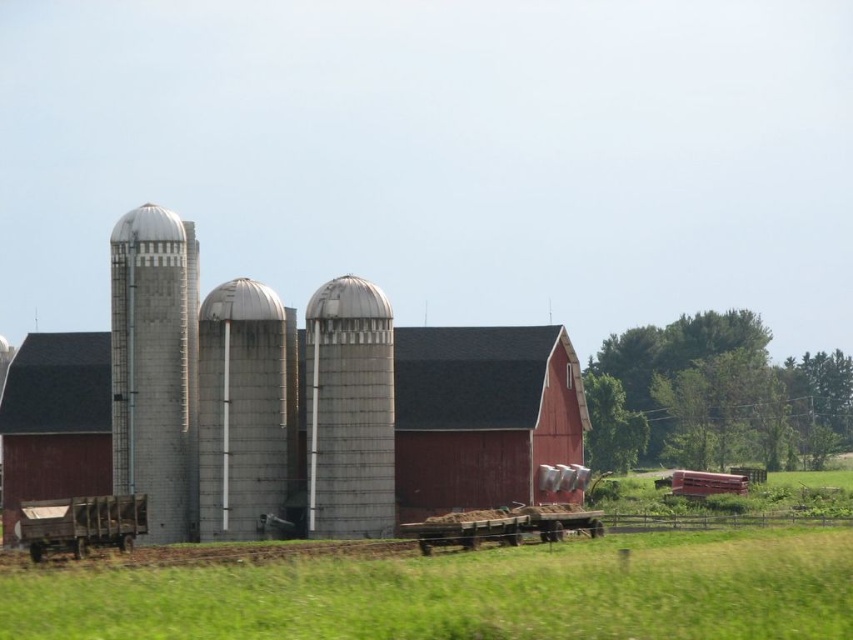
Is brown wooden wagon at lower center to the left of smooth wooden wagon at lower right from the viewer's perspective?

Indeed, brown wooden wagon at lower center is positioned on the left side of smooth wooden wagon at lower right.

Can you confirm if brown wooden wagon at lower center is smaller than smooth wooden wagon at lower right?

Incorrect, brown wooden wagon at lower center is not smaller in size than smooth wooden wagon at lower right.

What are the coordinates of `brown wooden wagon at lower center` in the screenshot? It's located at (502, 525).

Can you confirm if red painted wood barn at center is positioned to the left of sanded concrete silo at center?

Yes, red painted wood barn at center is to the left of sanded concrete silo at center.

Which is more to the left, red painted wood barn at center or sanded concrete silo at center?

Positioned to the left is red painted wood barn at center.

Where is `red painted wood barn at center`? Image resolution: width=853 pixels, height=640 pixels. red painted wood barn at center is located at coordinates (482, 416).

How much distance is there between red painted wood barn at center and brown wooden wagon at lower center?

8.36 meters

Describe the element at coordinates (482, 416) in the screenshot. I see `red painted wood barn at center` at that location.

The height and width of the screenshot is (640, 853). In order to click on red painted wood barn at center in this screenshot , I will do `click(482, 416)`.